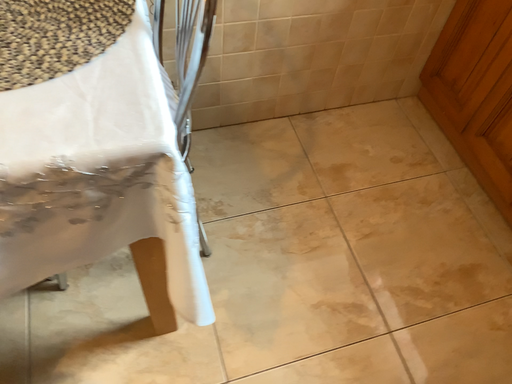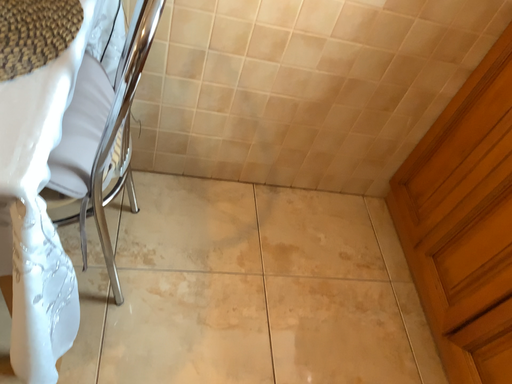
Question: Which way did the camera rotate in the video?

Choices:
 (A) rotated upward
 (B) rotated downward

Answer: (A)